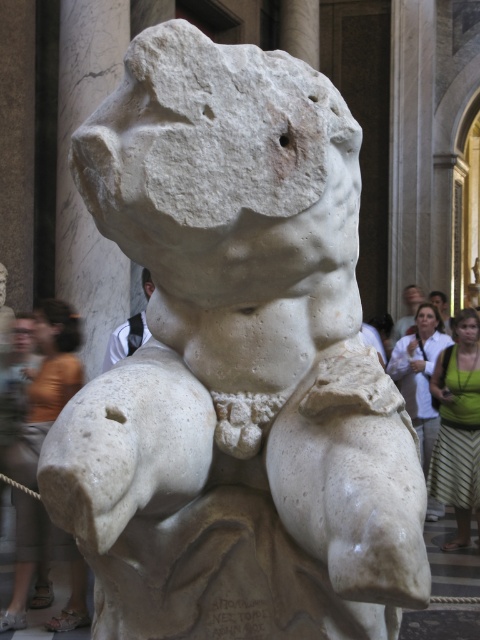
You are an art conservator examining the marble sculpture. You notice two points on the sculpture marked as point 1 at coordinates point (464, 390) and point 2 at coordinates point (448, 316). Which point is closer to your current position?

Point (464, 390) is closer to the viewer than point (448, 316).

You are an art conservator examining the marble sculpture in the museum. You notice two fabrics near the sculpture. The orange fabric at lower left and the green fabric dress at right. Which fabric is bigger in size?

The orange fabric at lower left is larger in size compared to the green fabric dress at right.

You are standing in front of the marble sculpture and want to place a small note on the green fabric skirt at lower right. Where should you place it?

The green fabric skirt at lower right is located at coordinates point (457, 426), so you should place the note there.